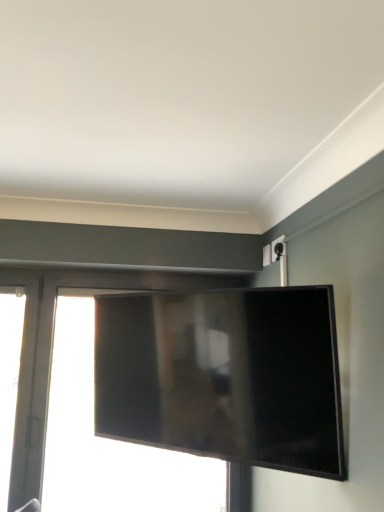
What do you see at coordinates (9, 379) in the screenshot?
I see `transparent glass window at left, which is the second window from right to left` at bounding box center [9, 379].

This screenshot has height=512, width=384. I want to click on matte black tv at center, so [x=224, y=376].

At what (x,y) coordinates should I click in order to perform the action: click on transparent glass window at center, arranged as the first window when viewed from the right. Please return your answer as a coordinate pair (x, y). Looking at the image, I should click on (83, 402).

Measure the distance between transparent glass window at center, which appears as the second window when viewed from the left, and camera.

transparent glass window at center, which appears as the second window when viewed from the left, and camera are 5.73 feet apart from each other.

I want to click on transparent glass window at left, which is the second window from right to left, so click(9, 379).

Can you see transparent glass window at center, arranged as the first window when viewed from the right, touching transparent glass window at left, marked as the first window in a left-to-right arrangement?

Result: No.

In the image, is transparent glass window at center, arranged as the first window when viewed from the right, positioned in front of or behind transparent glass window at left, which is the second window from right to left?

In the image, transparent glass window at center, arranged as the first window when viewed from the right, appears behind transparent glass window at left, which is the second window from right to left.

Does point (79, 446) come behind point (0, 468)?

Yes, it is behind point (0, 468).

Does transparent glass window at center, arranged as the first window when viewed from the right, have a lesser width compared to transparent glass window at left, marked as the first window in a left-to-right arrangement?

In fact, transparent glass window at center, arranged as the first window when viewed from the right, might be wider than transparent glass window at left, marked as the first window in a left-to-right arrangement.

Identify the location of the 2nd window behind the matte black tv at center. (83, 402).

Does matte black tv at center come behind transparent glass window at center, which appears as the second window when viewed from the left?

That is False.

Is matte black tv at center wider or thinner than transparent glass window at center, arranged as the first window when viewed from the right?

matte black tv at center is thinner than transparent glass window at center, arranged as the first window when viewed from the right.

From the picture: Is transparent glass window at center, arranged as the first window when viewed from the right, at the back of matte black tv at center?

Yes, matte black tv at center is facing away from transparent glass window at center, arranged as the first window when viewed from the right.

The width and height of the screenshot is (384, 512). Find the location of `the 1st window to the left of the matte black tv at center, starting your count from the anchor`. the 1st window to the left of the matte black tv at center, starting your count from the anchor is located at coordinates (83, 402).

From a real-world perspective, is transparent glass window at center, arranged as the first window when viewed from the right, under matte black tv at center?

Correct, in the physical world, transparent glass window at center, arranged as the first window when viewed from the right, is lower than matte black tv at center.

Can we say transparent glass window at center, which appears as the second window when viewed from the left, lies outside matte black tv at center?

Absolutely, transparent glass window at center, which appears as the second window when viewed from the left, is external to matte black tv at center.

Are transparent glass window at center, arranged as the first window when viewed from the right, and matte black tv at center making contact?

No, transparent glass window at center, arranged as the first window when viewed from the right, is not next to matte black tv at center.

Is matte black tv at center completely or partially inside transparent glass window at left, which is the second window from right to left?

No, matte black tv at center is located outside of transparent glass window at left, which is the second window from right to left.

How many degrees apart are the facing directions of transparent glass window at left, which is the second window from right to left, and matte black tv at center?

There is a 41.1-degree angle between the facing directions of transparent glass window at left, which is the second window from right to left, and matte black tv at center.

Is transparent glass window at left, marked as the first window in a left-to-right arrangement, closer to camera compared to matte black tv at center?

No, transparent glass window at left, marked as the first window in a left-to-right arrangement, is further to the viewer.

From a real-world perspective, between matte black tv at center and transparent glass window at left, which is the second window from right to left, who is vertically higher?

From a 3D spatial view, matte black tv at center is above.

Is matte black tv at center wider than transparent glass window at left, which is the second window from right to left?

Correct, the width of matte black tv at center exceeds that of transparent glass window at left, which is the second window from right to left.

Are matte black tv at center and transparent glass window at left, which is the second window from right to left, beside each other?

matte black tv at center and transparent glass window at left, which is the second window from right to left, are not in contact.

Relative to transparent glass window at center, which appears as the second window when viewed from the left, is transparent glass window at left, marked as the first window in a left-to-right arrangement, in front or behind?

transparent glass window at left, marked as the first window in a left-to-right arrangement, is positioned closer to the viewer than transparent glass window at center, which appears as the second window when viewed from the left.

Looking at the image, does transparent glass window at left, which is the second window from right to left, seem bigger or smaller compared to transparent glass window at center, arranged as the first window when viewed from the right?

Considering their sizes, transparent glass window at left, which is the second window from right to left, takes up less space than transparent glass window at center, arranged as the first window when viewed from the right.

Consider the image. Could you measure the distance between transparent glass window at left, marked as the first window in a left-to-right arrangement, and transparent glass window at center, which appears as the second window when viewed from the left?

9.95 inches.

Considering the sizes of transparent glass window at left, marked as the first window in a left-to-right arrangement, and transparent glass window at center, which appears as the second window when viewed from the left, in the image, is transparent glass window at left, marked as the first window in a left-to-right arrangement, wider or thinner than transparent glass window at center, which appears as the second window when viewed from the left,?

Considering their sizes, transparent glass window at left, marked as the first window in a left-to-right arrangement, looks slimmer than transparent glass window at center, which appears as the second window when viewed from the left.

Identify the location of window behind the transparent glass window at left, which is the second window from right to left. This screenshot has height=512, width=384. (83, 402).

The width and height of the screenshot is (384, 512). I want to click on television located above the transparent glass window at center, which appears as the second window when viewed from the left (from a real-world perspective), so pos(224,376).

Looking at the image, which one is located closer to transparent glass window at center, arranged as the first window when viewed from the right, transparent glass window at left, which is the second window from right to left, or matte black tv at center?

Based on the image, transparent glass window at left, which is the second window from right to left, appears to be nearer to transparent glass window at center, arranged as the first window when viewed from the right.

When comparing their distances from matte black tv at center, does transparent glass window at center, which appears as the second window when viewed from the left, or transparent glass window at left, which is the second window from right to left, seem closer?

transparent glass window at center, which appears as the second window when viewed from the left, is positioned closer to the anchor matte black tv at center.

Considering their positions, is matte black tv at center positioned further to transparent glass window at left, which is the second window from right to left, than transparent glass window at center, which appears as the second window when viewed from the left?

Among the two, matte black tv at center is located further to transparent glass window at left, which is the second window from right to left.

Which object lies nearer to the anchor point matte black tv at center, transparent glass window at left, marked as the first window in a left-to-right arrangement, or transparent glass window at center, arranged as the first window when viewed from the right?

→ transparent glass window at center, arranged as the first window when viewed from the right.

Based on their spatial positions, is transparent glass window at center, arranged as the first window when viewed from the right, or matte black tv at center closer to transparent glass window at left, which is the second window from right to left?

Based on the image, transparent glass window at center, arranged as the first window when viewed from the right, appears to be nearer to transparent glass window at left, which is the second window from right to left.

When comparing their distances from transparent glass window at center, which appears as the second window when viewed from the left, does matte black tv at center or transparent glass window at left, marked as the first window in a left-to-right arrangement, seem closer?

Based on the image, transparent glass window at left, marked as the first window in a left-to-right arrangement, appears to be nearer to transparent glass window at center, which appears as the second window when viewed from the left.

Locate an element on the screen. The width and height of the screenshot is (384, 512). window located between transparent glass window at left, which is the second window from right to left, and matte black tv at center in the left-right direction is located at coordinates (83, 402).